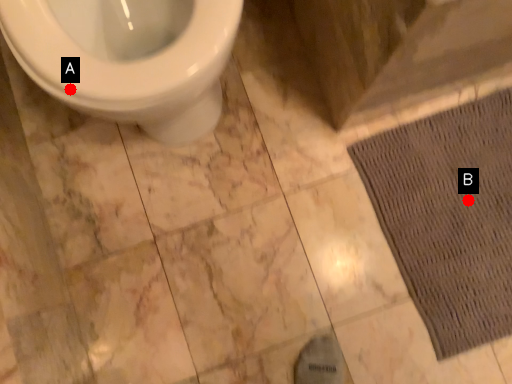
Question: Two points are circled on the image, labeled by A and B beside each circle. Which of the following is the closest to the observer?

Choices:
 (A) A is closer
 (B) B is closer

Answer: (A)